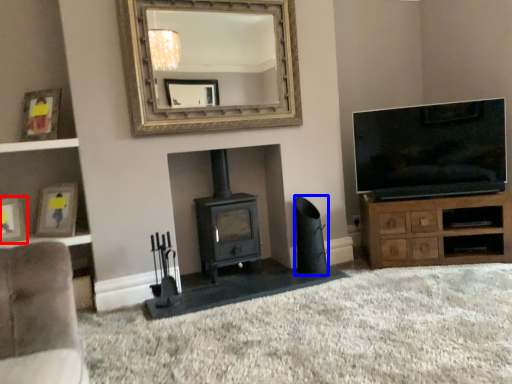
Question: Which object appears farthest to the camera in this image, picture frame (highlighted by a red box) or speaker (highlighted by a blue box)?

Choices:
 (A) picture frame
 (B) speaker

Answer: (B)